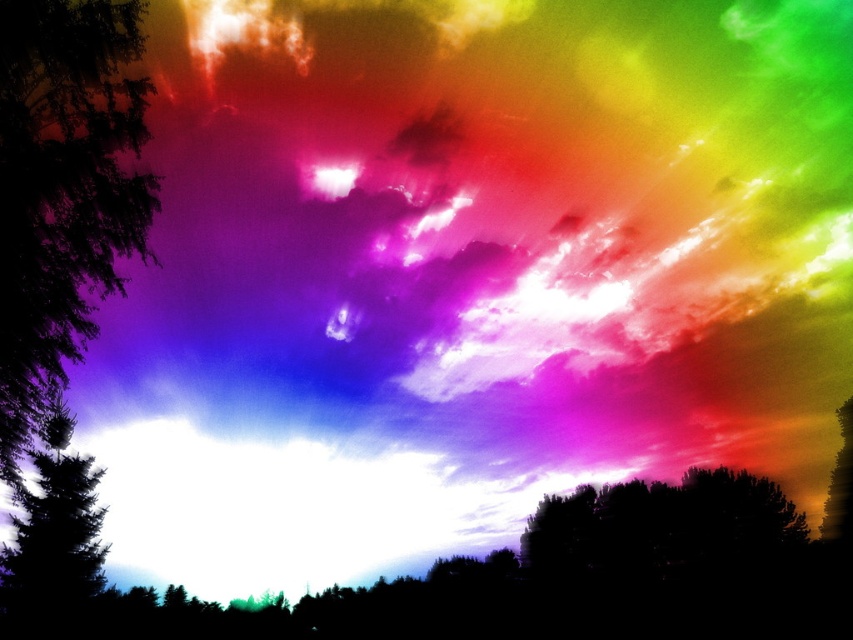
Question: From the image, what is the correct spatial relationship of silhouette leafy tree at left in relation to dark green textured tree at left?

Choices:
 (A) left
 (B) right

Answer: (B)

Question: Can you confirm if silhouette leafy tree at left is smaller than dark green textured tree at left?

Choices:
 (A) yes
 (B) no

Answer: (B)

Question: Which point is farther from the camera taking this photo?

Choices:
 (A) (102, 81)
 (B) (20, 548)

Answer: (B)

Question: Is silhouette leafy tree at left thinner than dark green textured tree at left?

Choices:
 (A) no
 (B) yes

Answer: (A)

Question: Among these points, which one is farthest from the camera?

Choices:
 (A) (25, 264)
 (B) (78, 472)

Answer: (B)